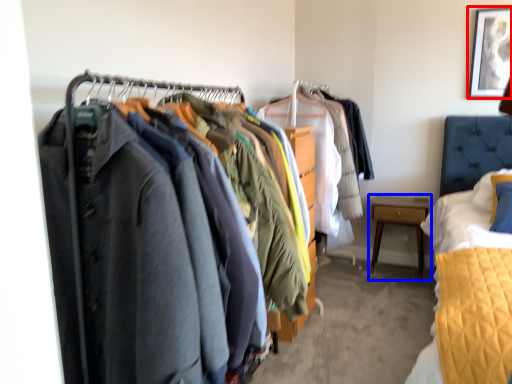
Question: Which object appears farthest to the camera in this image, picture frame (highlighted by a red box) or nightstand (highlighted by a blue box)?

Choices:
 (A) picture frame
 (B) nightstand

Answer: (B)